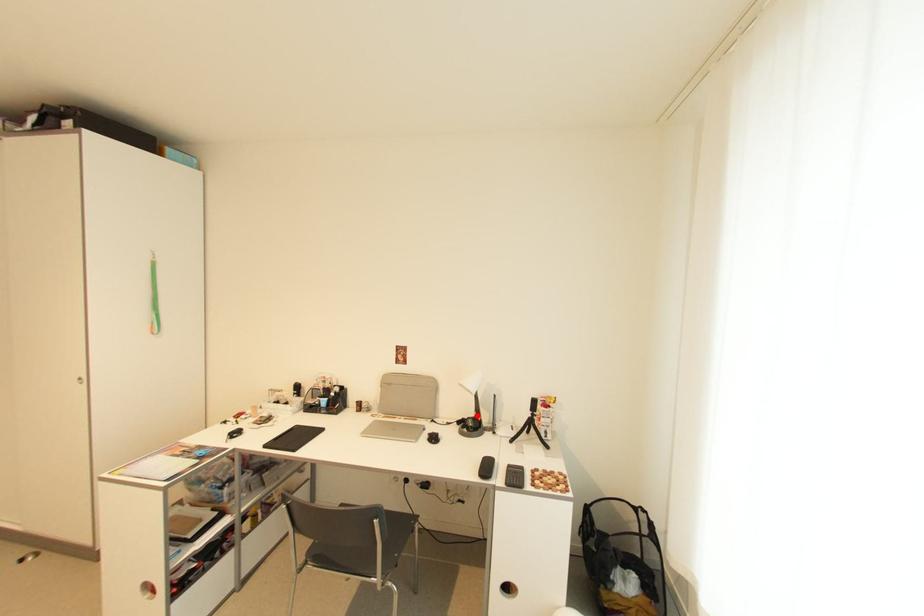
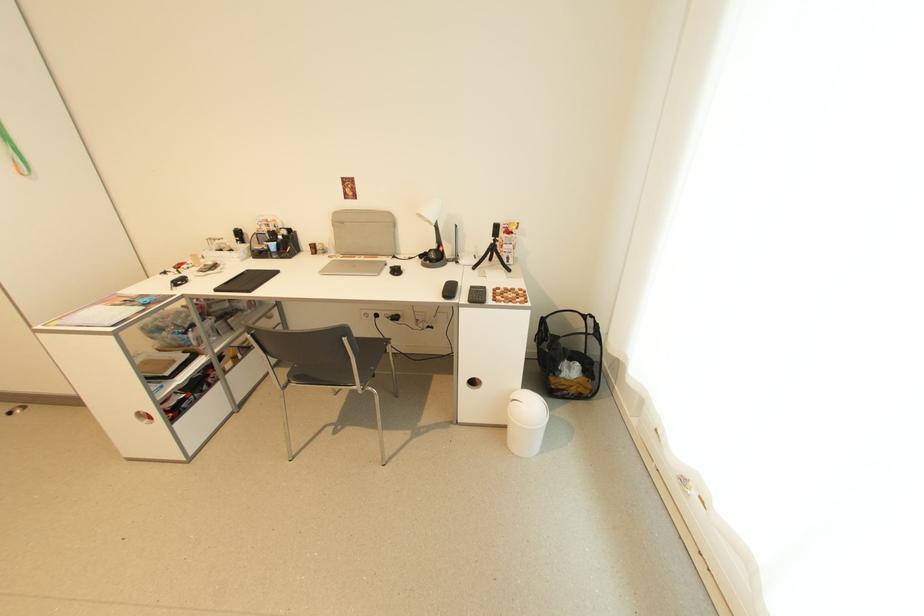
Question: I am providing you with two images of the same scene from different viewpoints. Image1 has a red point marked. In image2, the corresponding 3D location appears at what relative position? Reply with the corresponding letter.

Choices:
 (A) Closer
 (B) Farther

Answer: (A)